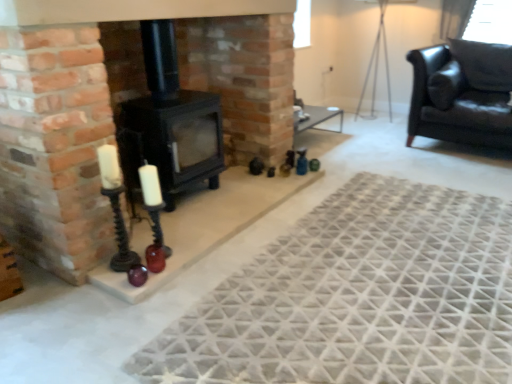
The height and width of the screenshot is (384, 512). What do you see at coordinates (358, 297) in the screenshot? I see `textured gray rug at center` at bounding box center [358, 297].

How much space does black wrought iron candle holder at left, marked as the 2th candle holder in a right-to-left arrangement, occupy vertically?

24.09 inches.

What do you see at coordinates (454, 103) in the screenshot? I see `black leather couch at upper right` at bounding box center [454, 103].

This screenshot has height=384, width=512. I want to click on black leather couch at upper right, so click(454, 103).

Locate an element on the screen. textured gray rug at center is located at coordinates (358, 297).

Can you confirm if black leather couch at upper right is taller than black wrought iron candle holder at left, marked as the 2th candle holder in a right-to-left arrangement?

Yes.

Would you say black leather couch at upper right contains black wrought iron candle holder at left, marked as the 2th candle holder in a right-to-left arrangement?

Definitely not — black wrought iron candle holder at left, marked as the 2th candle holder in a right-to-left arrangement, is not inside black leather couch at upper right.

You are a GUI agent. You are given a task and a screenshot of the screen. Output one action in this format:
    pyautogui.click(x=<x>, y=<y>)
    Task: Click on the studio couch located on the right of black wrought iron candle holder at left, marked as the 2th candle holder in a right-to-left arrangement
    The image size is (512, 384).
    Given the screenshot: What is the action you would take?
    pyautogui.click(x=454, y=103)

Is point (458, 98) positioned behind point (114, 154)?

Yes, it is behind point (114, 154).

Is black matte wood burning stove at center surrounded by black wrought iron candle holder at left, marked as the 1th candle holder in a left-to-right arrangement?

No, black matte wood burning stove at center is not a part of black wrought iron candle holder at left, marked as the 1th candle holder in a left-to-right arrangement.

Between black wrought iron candle holder at left, marked as the 2th candle holder in a right-to-left arrangement, and black matte wood burning stove at center, which one has less height?

With less height is black wrought iron candle holder at left, marked as the 2th candle holder in a right-to-left arrangement.

From a real-world perspective, is black wrought iron candle holder at left, marked as the 2th candle holder in a right-to-left arrangement, physically below black matte wood burning stove at center?

Correct, in the physical world, black wrought iron candle holder at left, marked as the 2th candle holder in a right-to-left arrangement, is lower than black matte wood burning stove at center.

Looking at this image, considering the sizes of objects black wrought iron candle holder at left, marked as the 1th candle holder in a left-to-right arrangement, and black matte wood burning stove at center in the image provided, who is thinner, black wrought iron candle holder at left, marked as the 1th candle holder in a left-to-right arrangement, or black matte wood burning stove at center?

Thinner between the two is black wrought iron candle holder at left, marked as the 1th candle holder in a left-to-right arrangement.

Based on the photo, what's the angular difference between black glass candle holder at lower left, positioned as the 2th candle holder in left-to-right order, and black leather couch at upper right's facing directions?

90 degrees separate the facing orientations of black glass candle holder at lower left, positioned as the 2th candle holder in left-to-right order, and black leather couch at upper right.

Would you say black leather couch at upper right is part of black glass candle holder at lower left, placed as the 1th candle holder when sorted from right to left,'s contents?

No.

Is point (153, 226) closer or farther from the camera than point (502, 128)?

Point (153, 226) is closer to the camera than point (502, 128).

In the scene shown: Is black glass candle holder at lower left, placed as the 1th candle holder when sorted from right to left, smaller than black leather couch at upper right?

Indeed, black glass candle holder at lower left, placed as the 1th candle holder when sorted from right to left, has a smaller size compared to black leather couch at upper right.

Can you tell me how much black leather couch at upper right and black glass candle holder at lower left, placed as the 1th candle holder when sorted from right to left, differ in facing direction?

black leather couch at upper right and black glass candle holder at lower left, placed as the 1th candle holder when sorted from right to left, are facing 90 degrees away from each other.

Image resolution: width=512 pixels, height=384 pixels. There is a black leather couch at upper right. In order to click on the 2nd candle holder below it (from the image's perspective) in this screenshot , I will do pos(153,202).

Is black glass candle holder at lower left, positioned as the 2th candle holder in left-to-right order, a part of black leather couch at upper right?

Actually, black glass candle holder at lower left, positioned as the 2th candle holder in left-to-right order, is outside black leather couch at upper right.

From the image's perspective, is black leather couch at upper right on top of black glass candle holder at lower left, placed as the 1th candle holder when sorted from right to left?

Yes, from the image's perspective, black leather couch at upper right is on top of black glass candle holder at lower left, placed as the 1th candle holder when sorted from right to left.

Locate an element on the screen. The image size is (512, 384). studio couch lying behind the black wrought iron candle holder at left, marked as the 2th candle holder in a right-to-left arrangement is located at coordinates 454,103.

Is black wrought iron candle holder at left, marked as the 1th candle holder in a left-to-right arrangement, closer to the viewer compared to black leather couch at upper right?

Yes, it is.

Is black wrought iron candle holder at left, marked as the 2th candle holder in a right-to-left arrangement, spatially inside black leather couch at upper right, or outside of it?

black wrought iron candle holder at left, marked as the 2th candle holder in a right-to-left arrangement, is spatially situated outside black leather couch at upper right.

From a real-world perspective, which is physically above, black wrought iron candle holder at left, marked as the 2th candle holder in a right-to-left arrangement, or black leather couch at upper right?

black leather couch at upper right.

Considering the sizes of textured gray rug at center and black matte wood burning stove at center in the image, is textured gray rug at center taller or shorter than black matte wood burning stove at center?

textured gray rug at center is shorter than black matte wood burning stove at center.

Is textured gray rug at center turned away from black matte wood burning stove at center?

No, textured gray rug at center is not facing away from black matte wood burning stove at center.

Is textured gray rug at center positioned before black matte wood burning stove at center?

Yes, textured gray rug at center is in front of black matte wood burning stove at center.

Considering the relative positions of textured gray rug at center and black matte wood burning stove at center in the image provided, is textured gray rug at center to the left of black matte wood burning stove at center from the viewer's perspective?

No, textured gray rug at center is not to the left of black matte wood burning stove at center.

From the image's perspective, is textured gray rug at center located above black wrought iron candle holder at left, marked as the 2th candle holder in a right-to-left arrangement?

No, from the image's perspective, textured gray rug at center is not over black wrought iron candle holder at left, marked as the 2th candle holder in a right-to-left arrangement.

From the picture: Is textured gray rug at center turned away from black wrought iron candle holder at left, marked as the 2th candle holder in a right-to-left arrangement?

No, textured gray rug at center's orientation is not away from black wrought iron candle holder at left, marked as the 2th candle holder in a right-to-left arrangement.

Is textured gray rug at center wider or thinner than black wrought iron candle holder at left, marked as the 1th candle holder in a left-to-right arrangement?

textured gray rug at center is wider than black wrought iron candle holder at left, marked as the 1th candle holder in a left-to-right arrangement.

Based on their sizes in the image, would you say textured gray rug at center is bigger or smaller than black wrought iron candle holder at left, marked as the 1th candle holder in a left-to-right arrangement?

Considering their sizes, textured gray rug at center takes up more space than black wrought iron candle holder at left, marked as the 1th candle holder in a left-to-right arrangement.

What are the coordinates of `the 1st candle holder directly beneath the black leather couch at upper right (from a real-world perspective)` in the screenshot? It's located at (116, 208).

Locate an element on the screen. The width and height of the screenshot is (512, 384). wood burning stove above the black wrought iron candle holder at left, marked as the 1th candle holder in a left-to-right arrangement (from a real-world perspective) is located at coordinates (170, 122).

Which object lies nearer to the anchor point black leather couch at upper right, black matte wood burning stove at center or black wrought iron candle holder at left, marked as the 1th candle holder in a left-to-right arrangement?

Among the two, black matte wood burning stove at center is located nearer to black leather couch at upper right.

Considering their positions, is black leather couch at upper right positioned further to textured gray rug at center than black matte wood burning stove at center?

Based on the image, black leather couch at upper right appears to be further to textured gray rug at center.

Looking at the image, which one is located further to black wrought iron candle holder at left, marked as the 2th candle holder in a right-to-left arrangement, black glass candle holder at lower left, placed as the 1th candle holder when sorted from right to left, or textured gray rug at center?

Based on the image, textured gray rug at center appears to be further to black wrought iron candle holder at left, marked as the 2th candle holder in a right-to-left arrangement.

Estimate the real-world distances between objects in this image. Which object is further from black leather couch at upper right, textured gray rug at center or black matte wood burning stove at center?

black matte wood burning stove at center lies further to black leather couch at upper right than the other object.

Estimate the real-world distances between objects in this image. Which object is further from textured gray rug at center, black wrought iron candle holder at left, marked as the 2th candle holder in a right-to-left arrangement, or black glass candle holder at lower left, placed as the 1th candle holder when sorted from right to left?

black wrought iron candle holder at left, marked as the 2th candle holder in a right-to-left arrangement, lies further to textured gray rug at center than the other object.

Estimate the real-world distances between objects in this image. Which object is further from black glass candle holder at lower left, positioned as the 2th candle holder in left-to-right order, black matte wood burning stove at center or textured gray rug at center?

The object further to black glass candle holder at lower left, positioned as the 2th candle holder in left-to-right order, is textured gray rug at center.

Looking at the image, which one is located closer to black matte wood burning stove at center, black leather couch at upper right or black wrought iron candle holder at left, marked as the 1th candle holder in a left-to-right arrangement?

Among the two, black wrought iron candle holder at left, marked as the 1th candle holder in a left-to-right arrangement, is located nearer to black matte wood burning stove at center.

Which object lies nearer to the anchor point black matte wood burning stove at center, black wrought iron candle holder at left, marked as the 2th candle holder in a right-to-left arrangement, or black leather couch at upper right?

black wrought iron candle holder at left, marked as the 2th candle holder in a right-to-left arrangement, is positioned closer to the anchor black matte wood burning stove at center.

Locate an element on the screen. The image size is (512, 384). candle holder between black wrought iron candle holder at left, marked as the 1th candle holder in a left-to-right arrangement, and black leather couch at upper right is located at coordinates (153, 202).

I want to click on mat between black wrought iron candle holder at left, marked as the 2th candle holder in a right-to-left arrangement, and black leather couch at upper right, in the horizontal direction, so click(x=358, y=297).

The width and height of the screenshot is (512, 384). Identify the location of mat between black glass candle holder at lower left, positioned as the 2th candle holder in left-to-right order, and black leather couch at upper right, in the horizontal direction. (358, 297).

Where is `mat between black matte wood burning stove at center and black leather couch at upper right`? Image resolution: width=512 pixels, height=384 pixels. mat between black matte wood burning stove at center and black leather couch at upper right is located at coordinates (358, 297).